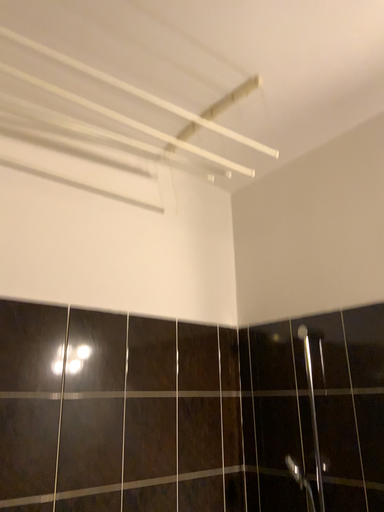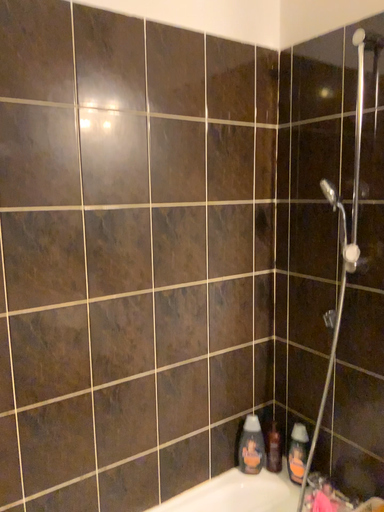
Question: How did the camera likely rotate when shooting the video?

Choices:
 (A) rotated downward
 (B) rotated upward

Answer: (A)